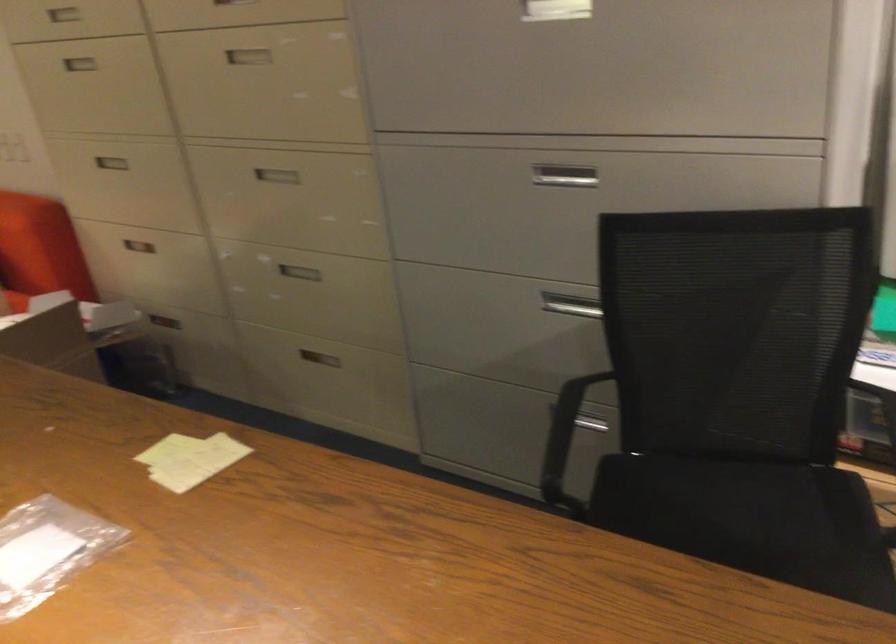
Which object does [190,459] point to?

This point indicates the yellow paper notes.